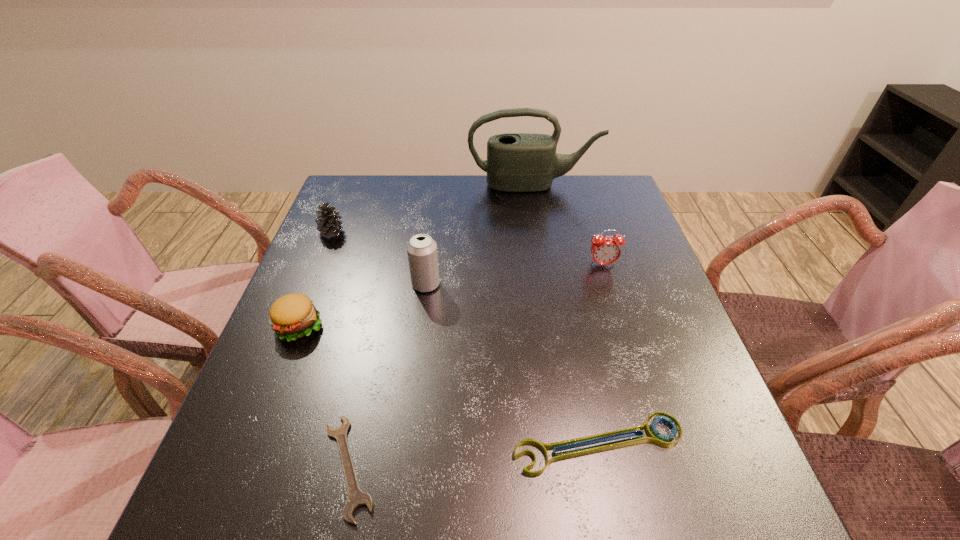
Locate an element on the screen. The height and width of the screenshot is (540, 960). vacant space that is in between the fourth nearest object and the tallest object is located at coordinates (479, 234).

The image size is (960, 540). Identify the location of vacant area that lies between the shortest object and the third nearest object. (324, 396).

You are a GUI agent. You are given a task and a screenshot of the screen. Output one action in this format:
    pyautogui.click(x=<x>, y=<y>)
    Task: Click on the free space that is in between the right wrench and the sixth shortest object
    Image resolution: width=960 pixels, height=540 pixels.
    Given the screenshot: What is the action you would take?
    pyautogui.click(x=513, y=364)

Choose which object is the third nearest neighbor to the pinecone. Please provide its 2D coordinates. Your answer should be formatted as a tuple, i.e. [(x, y)], where the tuple contains the x and y coordinates of a point satisfying the conditions above.

[(516, 162)]

Choose which object is the second nearest neighbor to the third object from left to right. Please provide its 2D coordinates. Your answer should be formatted as a tuple, i.e. [(x, y)], where the tuple contains the x and y coordinates of a point satisfying the conditions above.

[(654, 436)]

Find the location of a particular element. blank space that satisfies the following two spatial constraints: 1. on the front side of the fifth tallest object; 2. on the right side of the right wrench is located at coordinates (253, 444).